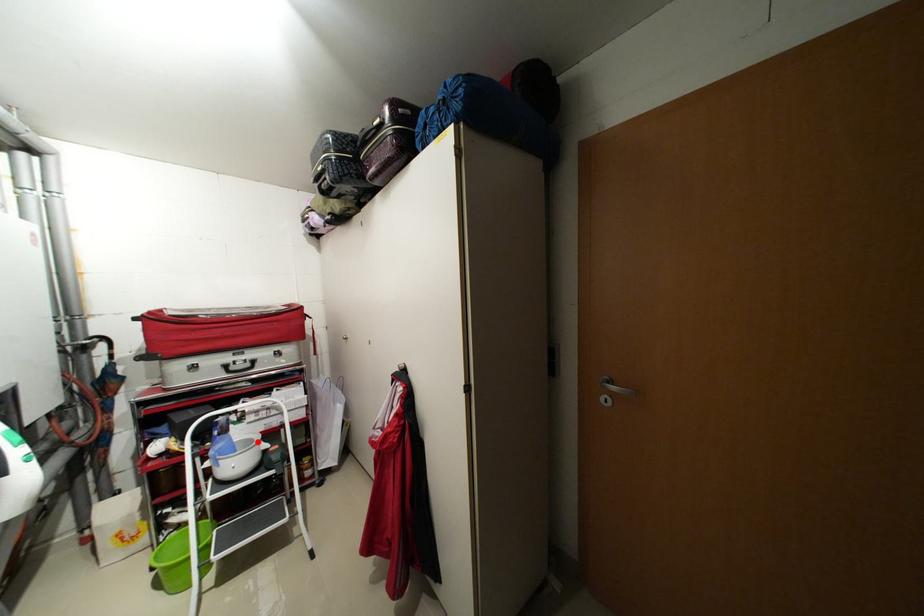
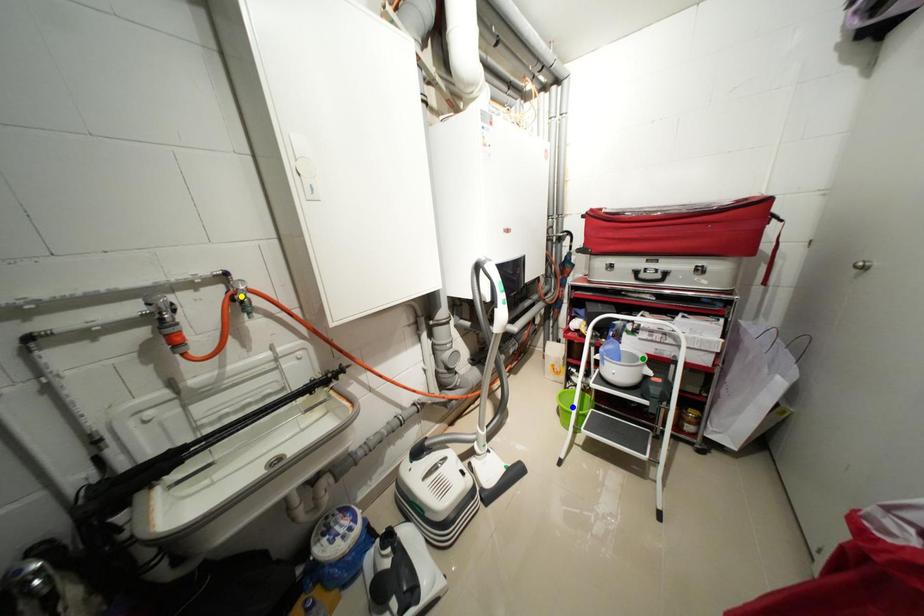
Question: I am providing you with two images of the same scene from different viewpoints. A red point is marked on the first image. You are given multiple points on the second image. Can you choose the point in image 2 that corresponds to the point in image 1?

Choices:
 (A) yellow point
 (B) blue point
 (C) green point

Answer: (C)